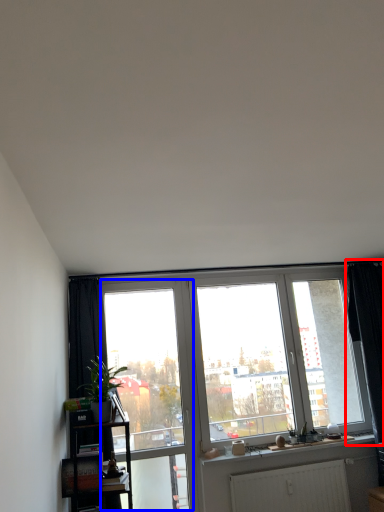
Question: Which of the following is the farthest to the observer, curtain (highlighted by a red box) or screen door (highlighted by a blue box)?

Choices:
 (A) curtain
 (B) screen door

Answer: (A)